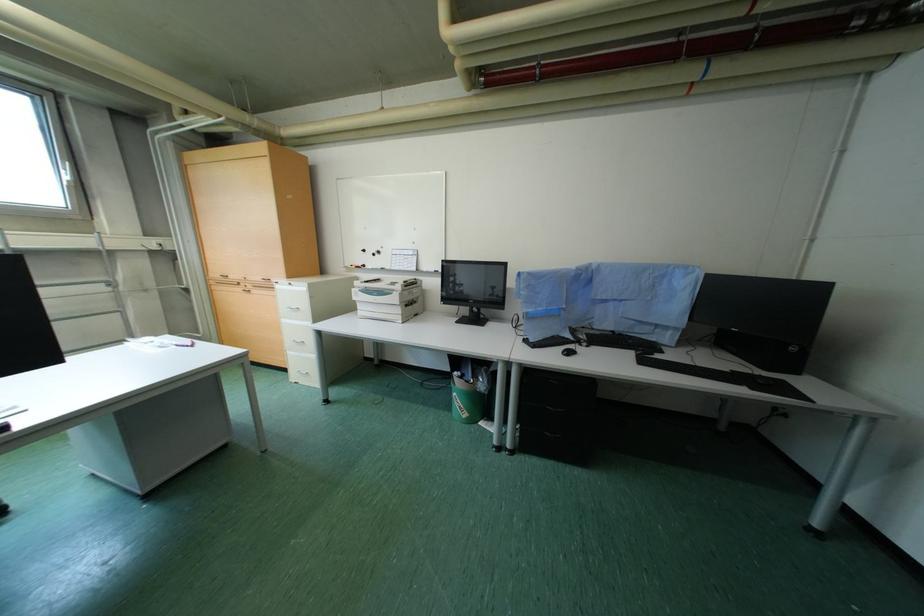
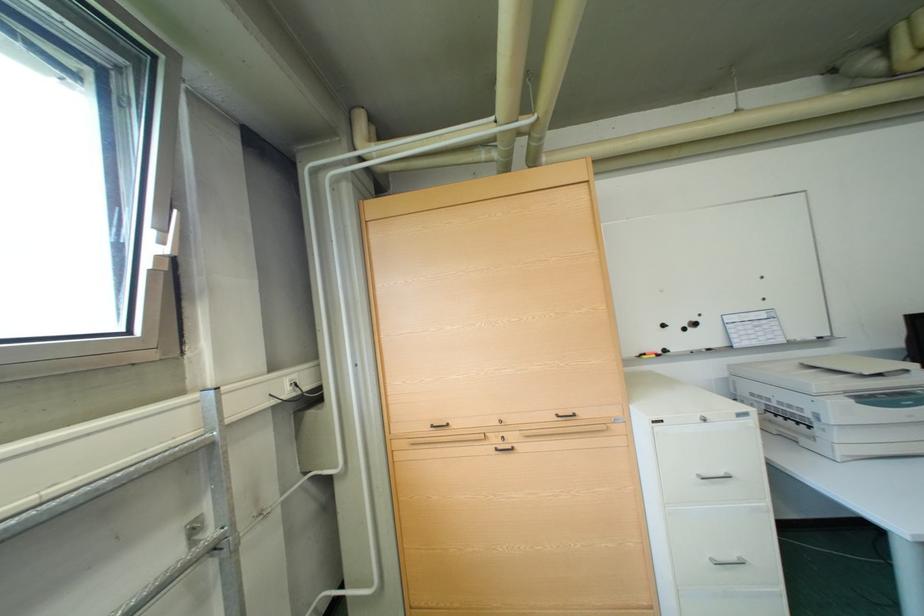
What movement of the cameraman would produce the second image?

The cameraman walked toward left, forward.